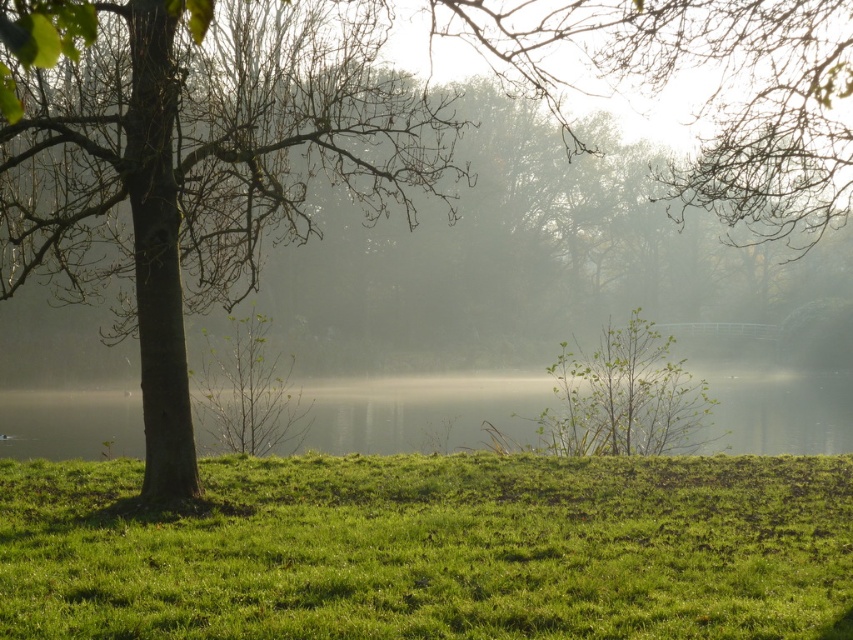
You are a gardener who needs to mow the lawn. You see the green grassy at lower left and the green water at center. Which area requires mowing?

The green grassy at lower left requires mowing because it is shorter than the green water at center, which is likely not grass and does not need mowing.

You are planning to set up a small tent for a morning meditation session. Given the scene, which area between the green grassy at lower left and the green water at center would be more suitable for placing the tent? Please consider the size of the areas as well as the context provided.

The green grassy at lower left has a smaller size compared to green water at center. Since the grassy area is smaller, it might not provide enough space for a tent. The green water at center is larger and flat, making it a better choice for placing the tent.